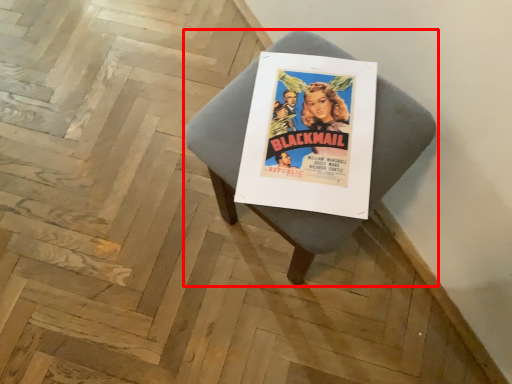
Question: Observing the image, what is the correct spatial positioning of furniture (annotated by the red box) in reference to poster?

Choices:
 (A) left
 (B) right

Answer: (B)